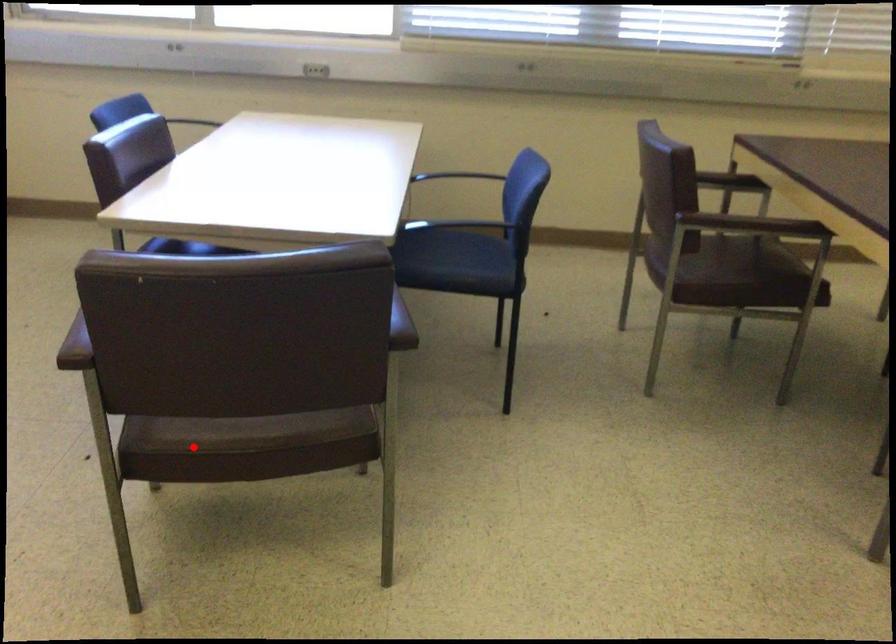
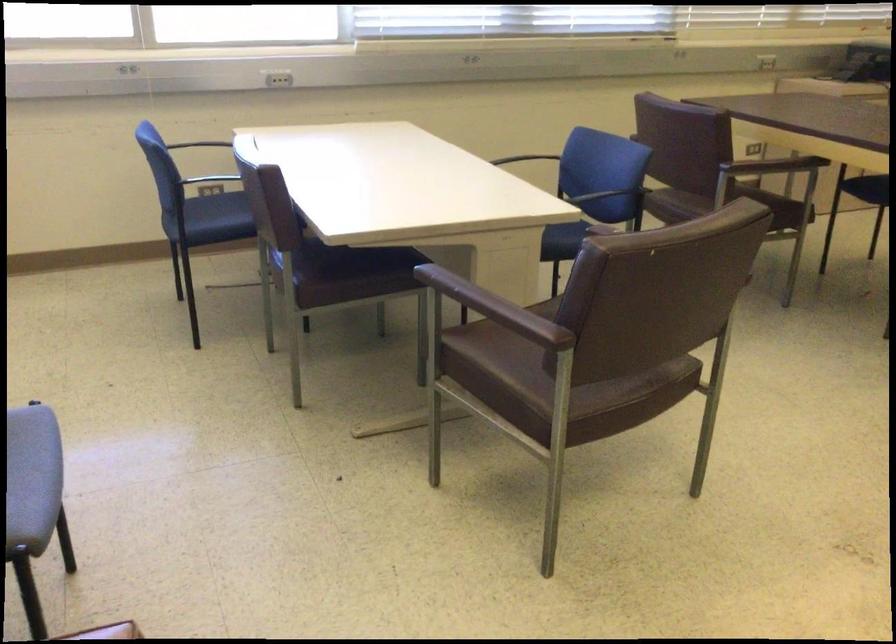
Question: I am providing you with two images of the same scene from different viewpoints. Image1 has a red point marked. In image2, the corresponding 3D location appears at what relative position? Reply with the corresponding letter.

Choices:
 (A) Closer
 (B) Farther

Answer: (B)